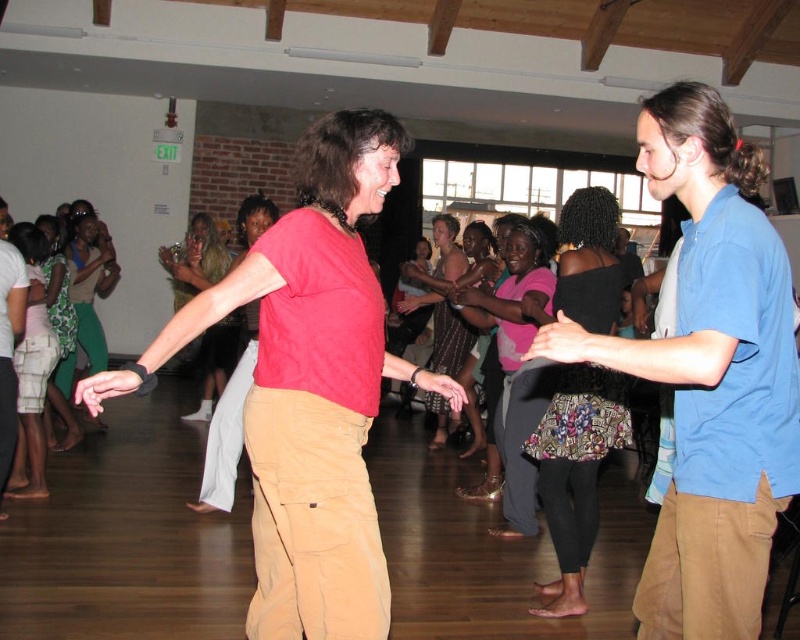
Question: Can you confirm if green textured shorts at lower left is positioned above green textured dress at left?

Choices:
 (A) no
 (B) yes

Answer: (A)

Question: Among these objects, which one is farthest from the camera?

Choices:
 (A) green textured dress at lower left
 (B) patterned fabric dress at center
 (C) matte pink shirt at center
 (D) green textured shorts at lower left

Answer: (A)

Question: Is the position of matte pink shirt at center more distant than that of matte red shirt at center?

Choices:
 (A) no
 (B) yes

Answer: (A)

Question: Which point is farther to the camera?

Choices:
 (A) floral fabric skirt at center
 (B) green textured dress at left
 (C) matte pink shirt at center
 (D) matte khaki pants at center

Answer: (B)

Question: Which point is closer to the camera?

Choices:
 (A) (49, 218)
 (B) (472, 332)
 (C) (202, 278)

Answer: (C)

Question: Can you confirm if khaki pants at right is positioned below green textured dress at left?

Choices:
 (A) no
 (B) yes

Answer: (B)